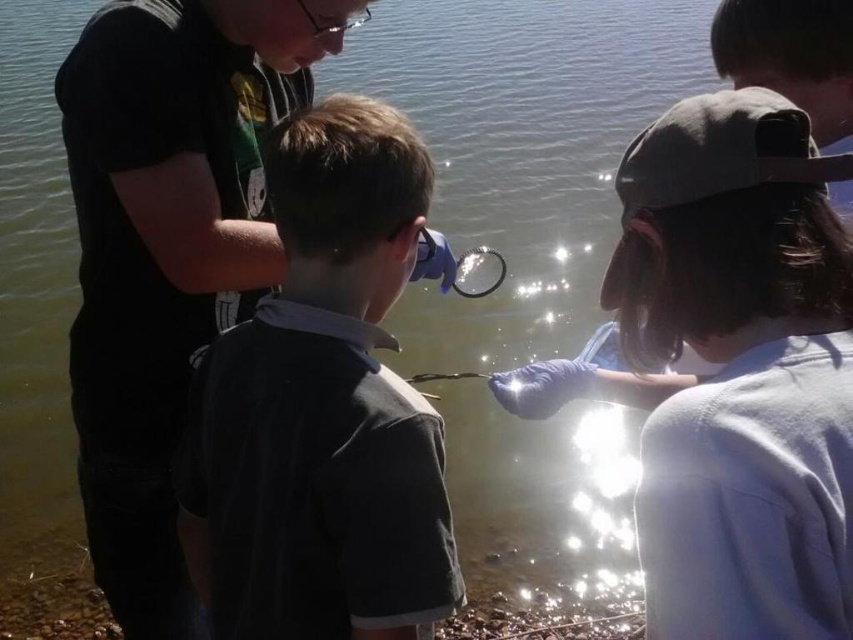
In the scene described, there are two individuals wearing different shirts. The dark gray cotton shirt at center and the black matte shirt at left. From the perspective of someone standing at the center of the image, which shirt is positioned to the left?

The black matte shirt at left is positioned to the left of the dark gray cotton shirt at center from the center perspective.

What is the color of the fabric at the point with coordinates (740,369)?

The point at coordinates (740,369) is on light blue fabric at center.